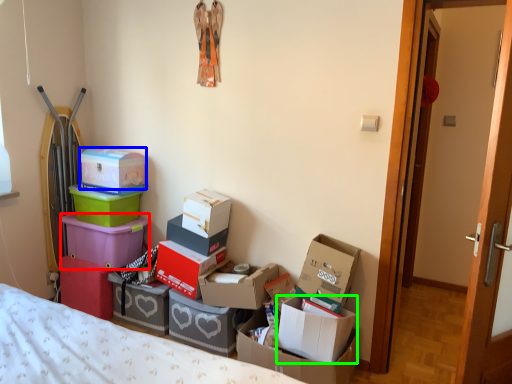
Question: Which is nearer to the box (highlighted by a red box)? box (highlighted by a blue box) or box (highlighted by a green box).

Choices:
 (A) box
 (B) box

Answer: (A)